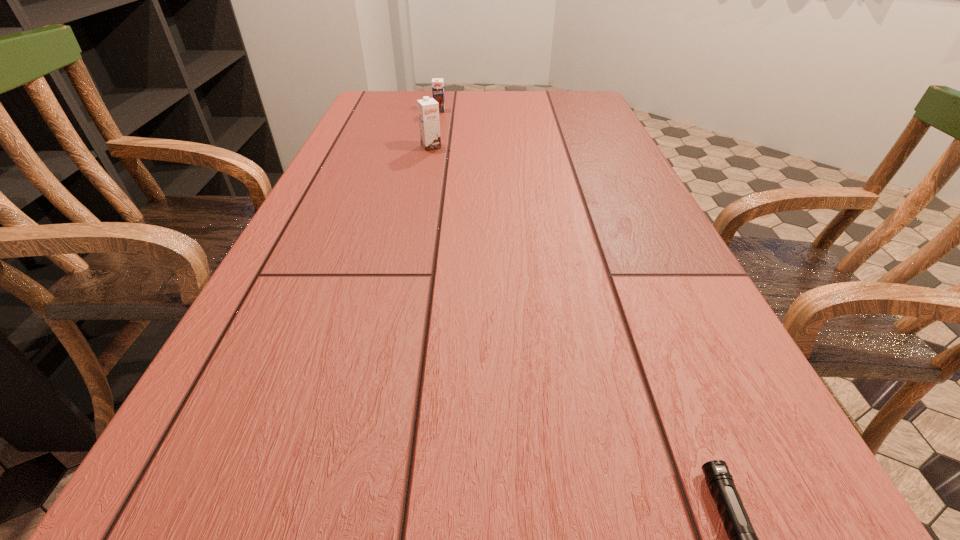
Identify the location of free space at the far left corner of the desktop. This screenshot has height=540, width=960. (391, 105).

Where is `free region at the far right corner`? The width and height of the screenshot is (960, 540). free region at the far right corner is located at coordinates (578, 103).

Identify which object is the second closest to the taller chocolate milk. Please provide its 2D coordinates. Your answer should be formatted as a tuple, i.e. [(x, y)], where the tuple contains the x and y coordinates of a point satisfying the conditions above.

[(743, 539)]

The width and height of the screenshot is (960, 540). In order to click on object that ranks as the closest to the flashlight in this screenshot , I will do `click(428, 109)`.